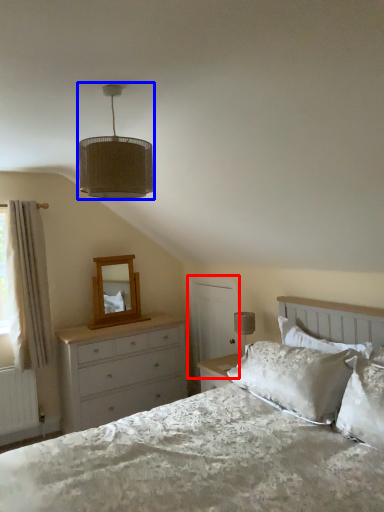
Question: Which of the following is the closest to the observer, screen door (highlighted by a red box) or lamp (highlighted by a blue box)?

Choices:
 (A) screen door
 (B) lamp

Answer: (B)